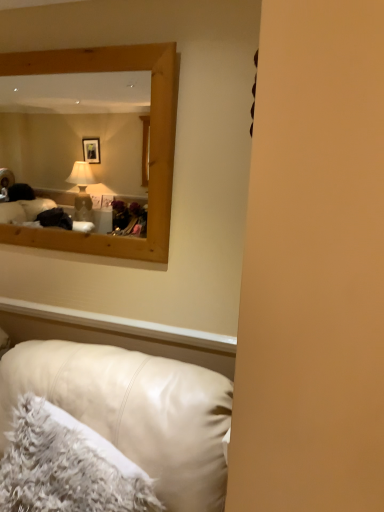
Question: Should I look upward or downward to see white fluffy pillow at lower left?

Choices:
 (A) up
 (B) down

Answer: (B)

Question: Is the surface of leather couch at lower left in direct contact with white fluffy pillow at lower left?

Choices:
 (A) no
 (B) yes

Answer: (A)

Question: Is leather couch at lower left oriented towards white fluffy pillow at lower left?

Choices:
 (A) no
 (B) yes

Answer: (B)

Question: Is leather couch at lower left facing away from white fluffy pillow at lower left?

Choices:
 (A) yes
 (B) no

Answer: (A)

Question: From a real-world perspective, is leather couch at lower left positioned under white fluffy pillow at lower left based on gravity?

Choices:
 (A) yes
 (B) no

Answer: (A)

Question: From the image's perspective, is leather couch at lower left on top of white fluffy pillow at lower left?

Choices:
 (A) no
 (B) yes

Answer: (A)

Question: Considering the relative sizes of leather couch at lower left and white fluffy pillow at lower left in the image provided, is leather couch at lower left wider than white fluffy pillow at lower left?

Choices:
 (A) no
 (B) yes

Answer: (B)

Question: Is white fluffy pillow at lower left looking in the opposite direction of leather couch at lower left?

Choices:
 (A) no
 (B) yes

Answer: (B)

Question: Does white fluffy pillow at lower left contain leather couch at lower left?

Choices:
 (A) yes
 (B) no

Answer: (B)

Question: Can you confirm if white fluffy pillow at lower left is wider than leather couch at lower left?

Choices:
 (A) yes
 (B) no

Answer: (B)

Question: Is white fluffy pillow at lower left placed right next to leather couch at lower left?

Choices:
 (A) yes
 (B) no

Answer: (B)

Question: Is white fluffy pillow at lower left facing towards leather couch at lower left?

Choices:
 (A) no
 (B) yes

Answer: (B)

Question: Can we say white fluffy pillow at lower left lies outside leather couch at lower left?

Choices:
 (A) no
 (B) yes

Answer: (A)

Question: Is leather couch at lower left bigger or smaller than white fluffy pillow at lower left?

Choices:
 (A) small
 (B) big

Answer: (B)